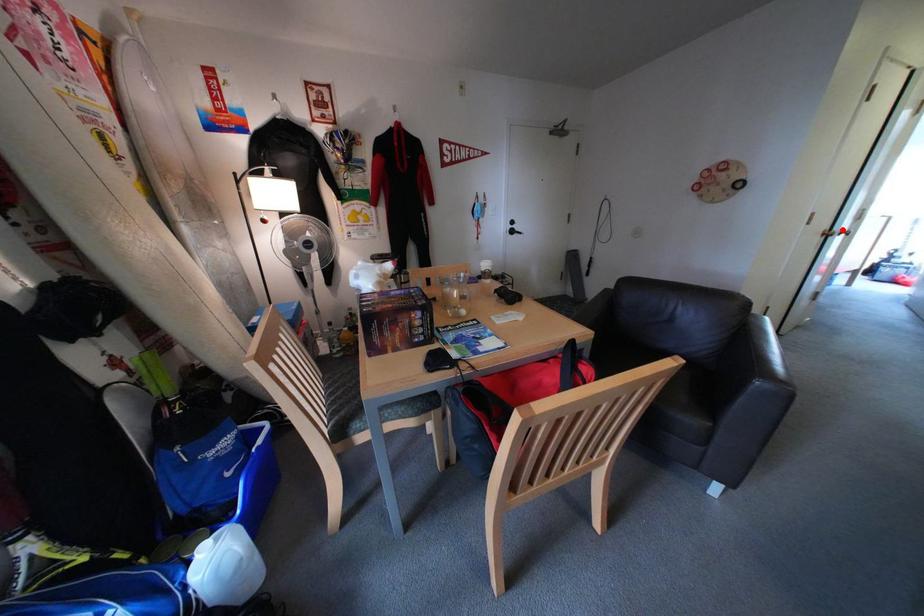
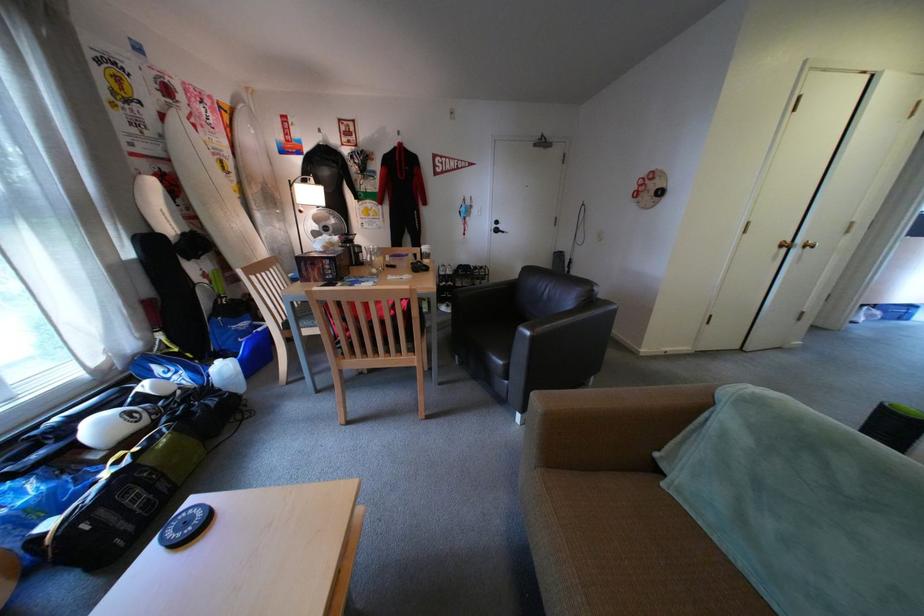
Question: I am providing you with two images of the same scene from different viewpoints. In image1, a red point is highlighted. Considering the same 3D point in image2, which of the following is correct?

Choices:
 (A) It is closer
 (B) It is farther

Answer: (B)